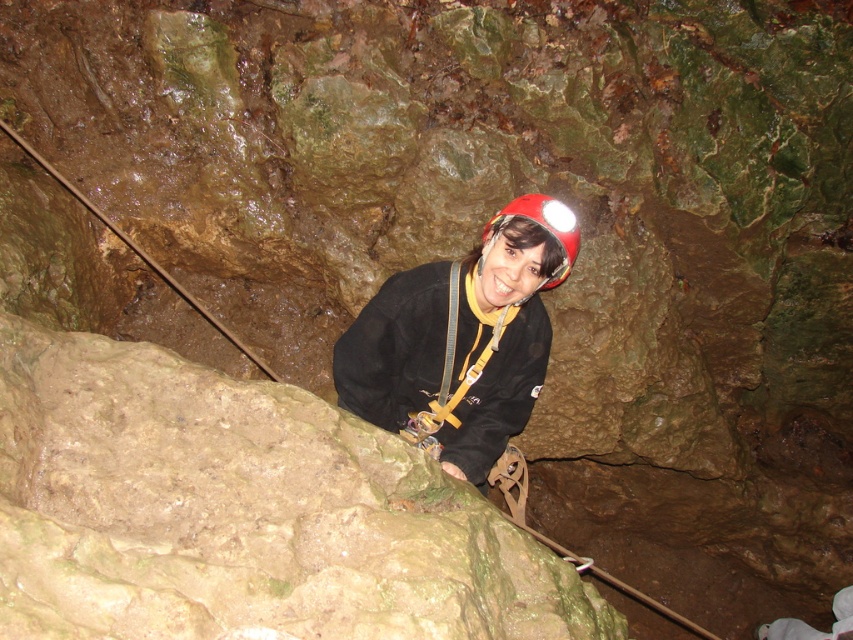
Question: Where is matte black jacket at center located in relation to red matte helmet at center in the image?

Choices:
 (A) above
 (B) below

Answer: (B)

Question: Does matte black jacket at center have a lesser width compared to red matte helmet at center?

Choices:
 (A) yes
 (B) no

Answer: (B)

Question: Among these points, which one is nearest to the camera?

Choices:
 (A) (418, 422)
 (B) (509, 211)

Answer: (B)

Question: Considering the relative positions of matte black jacket at center and red matte helmet at center in the image provided, where is matte black jacket at center located with respect to red matte helmet at center?

Choices:
 (A) above
 (B) below

Answer: (B)

Question: Which point is farther to the camera?

Choices:
 (A) red matte helmet at center
 (B) matte black jacket at center

Answer: (B)

Question: Which object is farther from the camera taking this photo?

Choices:
 (A) matte black jacket at center
 (B) red matte helmet at center

Answer: (A)